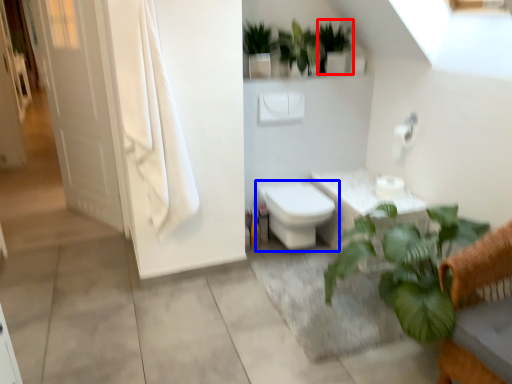
Question: Which point is closer to the camera, vegetation (highlighted by a red box) or toilet (highlighted by a blue box)?

Choices:
 (A) vegetation
 (B) toilet

Answer: (B)